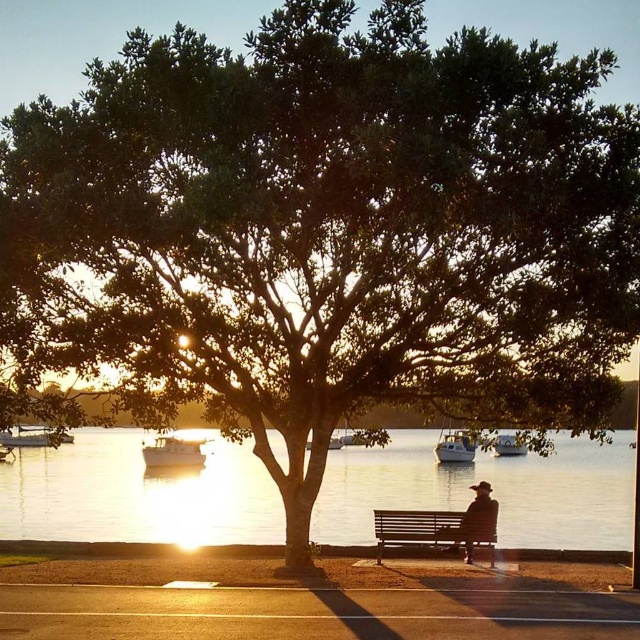
Does glistening water at center have a lesser width compared to wooden bench at center?

In fact, glistening water at center might be wider than wooden bench at center.

Does glistening water at center appear under wooden bench at center?

Yes.

Between point (132, 493) and point (484, 524), which one is positioned behind?

Positioned behind is point (132, 493).

Where is `glistening water at center`? glistening water at center is located at coordinates (493, 490).

Based on the photo, who is higher up, metallic blue boat at center or white plastic boat at center?

white plastic boat at center is above.

In the scene shown: Who is more distant from viewer, (500, 452) or (364, 444)?

Positioned behind is point (500, 452).

Identify the location of metallic blue boat at center. The height and width of the screenshot is (640, 640). (508, 445).

Does white wooden boat at lower left have a smaller size compared to metallic blue boat at center?

No.

Which is in front, point (4, 436) or point (513, 440)?

Point (513, 440)

Is point (8, 429) closer to camera compared to point (502, 435)?

Yes, point (8, 429) is in front of point (502, 435).

The height and width of the screenshot is (640, 640). I want to click on white wooden boat at lower left, so click(x=26, y=435).